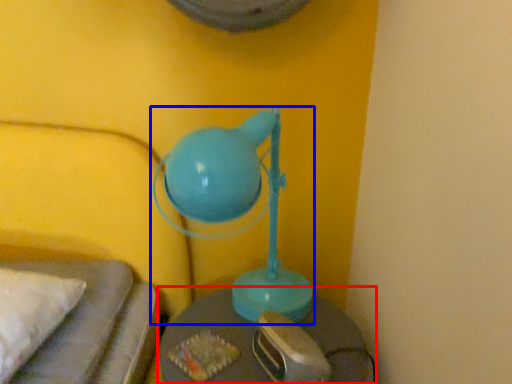
Question: Among these objects, which one is nearest to the camera, table (highlighted by a red box) or lamp (highlighted by a blue box)?

Choices:
 (A) table
 (B) lamp

Answer: (B)